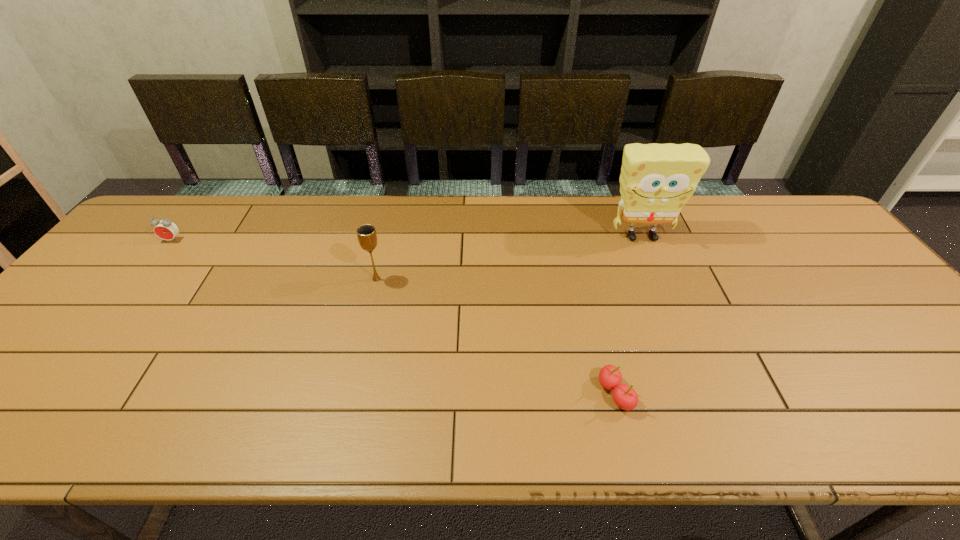
This screenshot has width=960, height=540. I want to click on free space that is in between the sponge and the nearest object, so (x=628, y=315).

The image size is (960, 540). I want to click on free area in between the second nearest object and the nearest object, so click(x=495, y=336).

Find the location of a particular element. The width and height of the screenshot is (960, 540). vacant area that lies between the leftmost object and the second nearest object is located at coordinates (275, 260).

Image resolution: width=960 pixels, height=540 pixels. Identify the location of free space between the leftmost object and the rightmost object. (407, 239).

The height and width of the screenshot is (540, 960). In order to click on vacant space in between the third object from right to left and the alarm clock in this screenshot , I will do `click(275, 260)`.

Locate an element on the screen. This screenshot has width=960, height=540. vacant space that's between the cherry and the sponge is located at coordinates (628, 315).

Identify the location of vacant space in between the third farthest object and the third object from left to right. (495, 336).

You are a GUI agent. You are given a task and a screenshot of the screen. Output one action in this format:
    pyautogui.click(x=<x>, y=<y>)
    Task: Click on the vacant area that lies between the sponge and the leftmost object
    
    Given the screenshot: What is the action you would take?
    pyautogui.click(x=407, y=239)

Locate an element on the screen. This screenshot has height=540, width=960. unoccupied area between the leftmost object and the third object from right to left is located at coordinates (275, 260).

I want to click on free space between the tallest object and the third object from left to right, so click(x=628, y=315).